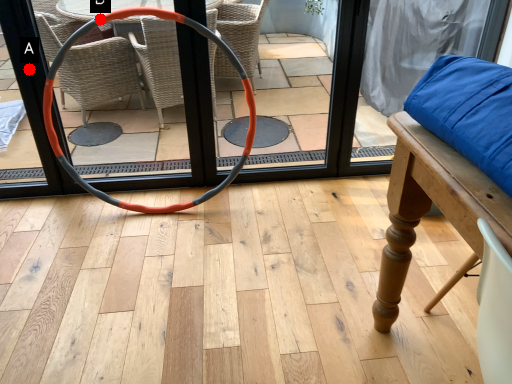
Question: Two points are circled on the image, labeled by A and B beside each circle. Among these points, which one is farthest from the camera?

Choices:
 (A) A is further
 (B) B is further

Answer: (A)